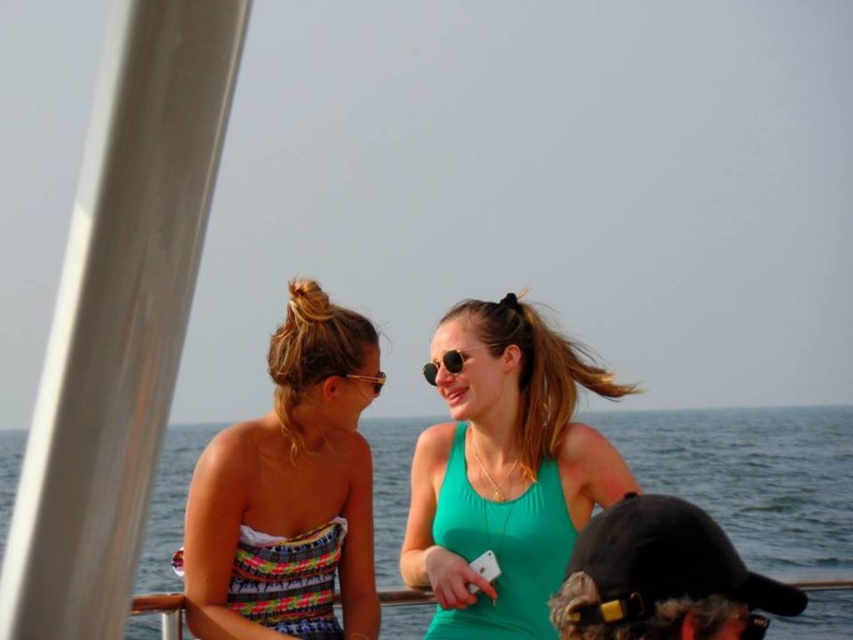
Does multicolored strapless dress at left appear over matte gold goggles at upper center?

Incorrect, multicolored strapless dress at left is not positioned above matte gold goggles at upper center.

Does multicolored strapless dress at left have a lesser width compared to matte gold goggles at upper center?

No.

Which is behind, point (260, 440) or point (328, 374)?

The point (328, 374) is behind.

Where is `multicolored strapless dress at left`? The height and width of the screenshot is (640, 853). multicolored strapless dress at left is located at coordinates (289, 493).

Between multicolored strapless dress at left and black matte baseball cap at lower right, which one appears on the left side from the viewer's perspective?

Positioned to the left is multicolored strapless dress at left.

Can you confirm if multicolored strapless dress at left is wider than black matte baseball cap at lower right?

Indeed, multicolored strapless dress at left has a greater width compared to black matte baseball cap at lower right.

This screenshot has height=640, width=853. Identify the location of multicolored strapless dress at left. (289, 493).

Locate an element on the screen. multicolored strapless dress at left is located at coordinates (289, 493).

Does point (541, 528) lie behind point (219, 604)?

Yes, it is behind point (219, 604).

Is the position of green matte tank top at center more distant than that of multicolored strapless dress at left?

Yes.

Does point (444, 480) come closer to viewer compared to point (332, 465)?

No, it is not.

Identify the location of green matte tank top at center. This screenshot has height=640, width=853. (505, 472).